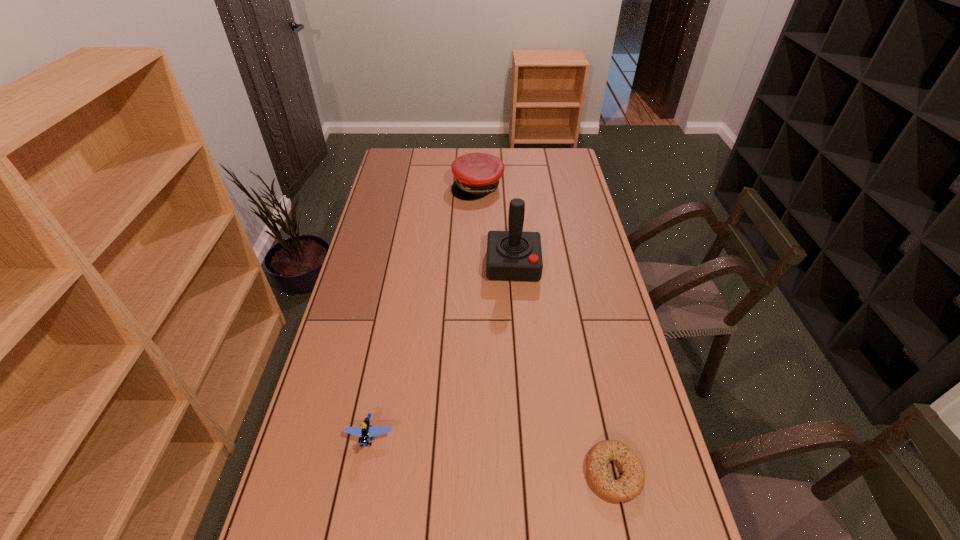
At what (x,y) coordinates should I click in order to perform the action: click on Lego. Please return your answer as a coordinate pair (x, y). This screenshot has width=960, height=540. Looking at the image, I should click on (366, 431).

Locate an element on the screen. the leftmost object is located at coordinates (366, 431).

Locate an element on the screen. The image size is (960, 540). the shortest object is located at coordinates (631, 483).

Locate an element on the screen. the rightmost object is located at coordinates (631, 483).

This screenshot has width=960, height=540. I want to click on cap, so click(x=477, y=174).

Identify the location of the second tallest object. (477, 174).

The image size is (960, 540). Identify the location of joystick. (513, 255).

Where is `the tallest object`? Image resolution: width=960 pixels, height=540 pixels. the tallest object is located at coordinates (513, 255).

In order to click on vacant space located on the front-facing side of the leftmost object in this screenshot , I will do `click(355, 515)`.

Find the location of a particular element. free space located on the left of the rightmost object is located at coordinates (499, 473).